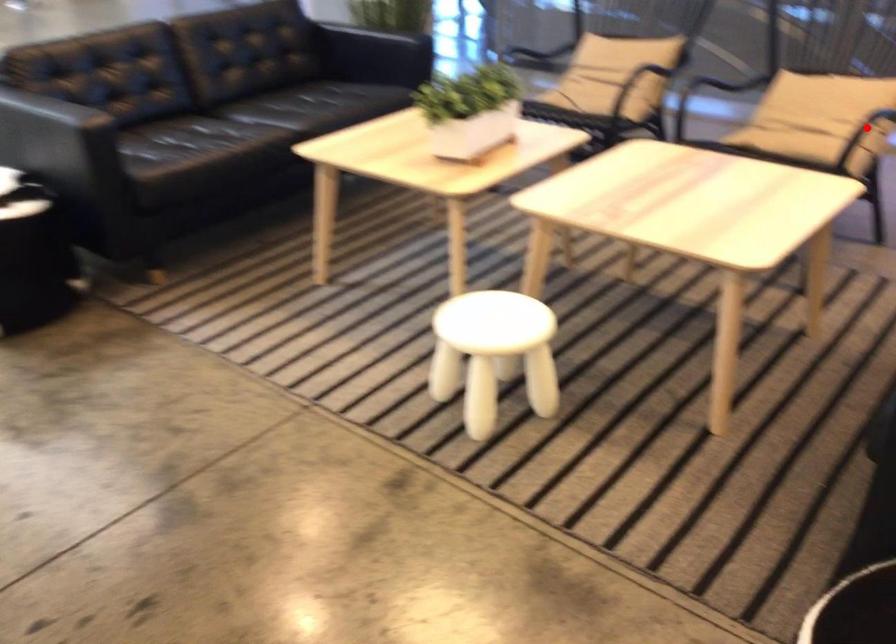
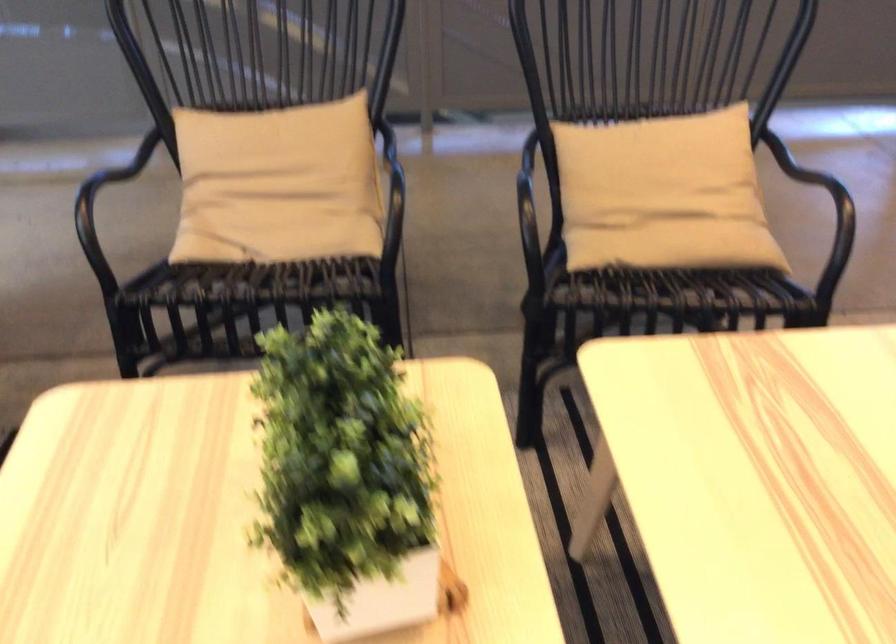
Question: I am providing you with two images of the same scene from different viewpoints. A red point is marked on the first image. Can you still see the location of the red point in image 2?

Choices:
 (A) Yes
 (B) No

Answer: (B)